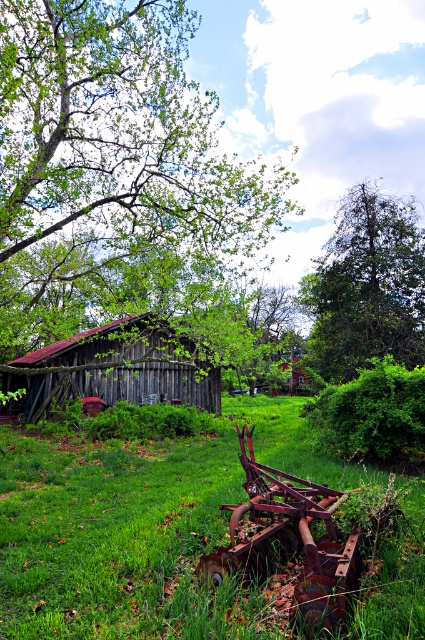
Question: Is green grassy at lower center wider than green leafy tree at upper center?

Choices:
 (A) no
 (B) yes

Answer: (B)

Question: Which is nearer to the weathered wood hut at left?

Choices:
 (A) green leafy tree at upper center
 (B) rusty metal tractor at lower center

Answer: (A)

Question: Can you confirm if green leafy tree at upper center is smaller than weathered wood hut at left?

Choices:
 (A) yes
 (B) no

Answer: (B)

Question: Estimate the real-world distances between objects in this image. Which object is closer to the weathered wood hut at left?

Choices:
 (A) green grassy at lower center
 (B) green leafy tree at upper center

Answer: (A)

Question: Is green leafy tree at upper left to the right of weathered wood hut at left from the viewer's perspective?

Choices:
 (A) no
 (B) yes

Answer: (B)

Question: Which object is the closest to the green leafy tree at upper left?

Choices:
 (A) rusty metal tractor at lower center
 (B) weathered wood hut at left
 (C) green grassy at lower center
 (D) green leafy tree at upper center

Answer: (B)